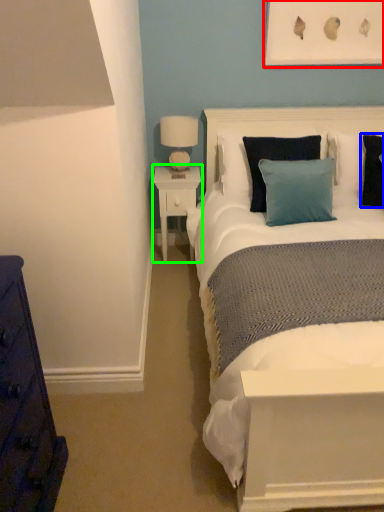
Question: Considering the real-world distances, which object is closest to picture frame (highlighted by a red box)? pillow (highlighted by a blue box) or nightstand (highlighted by a green box).

Choices:
 (A) pillow
 (B) nightstand

Answer: (A)